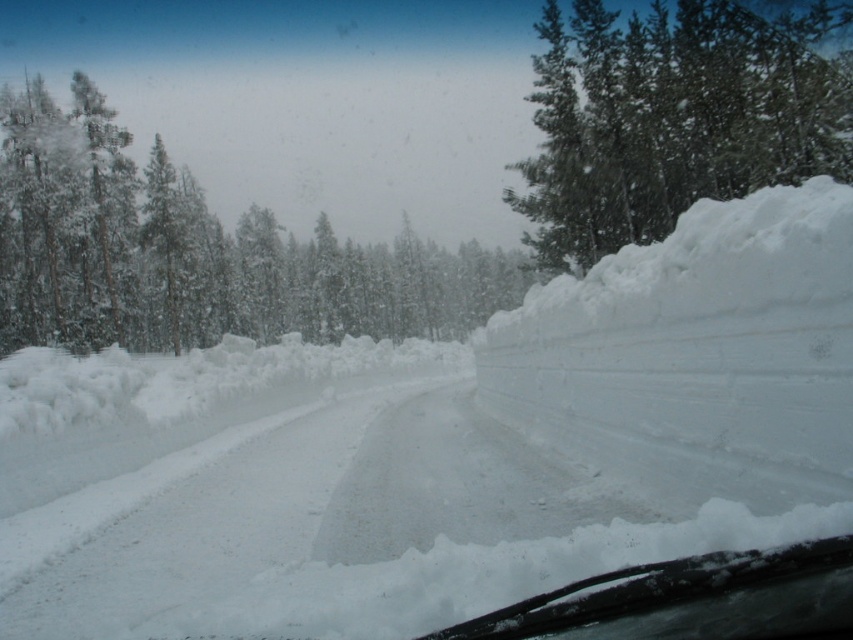
You are a driver planning to take a scenic route through this snowy area. You notice the white frosty trees at upper center and the green textured snow at upper right in your view. Which of these two elements takes up more visual space in the scene?

The green textured snow at upper right takes up more visual space than the white frosty trees at upper center.

You are driving a car and looking through the windshield. You notice the green textured snow at upper right and the clear glass windshield at lower center. Which object appears wider from your viewpoint?

The green textured snow at upper right appears wider than the clear glass windshield at lower center because its width surpasses the windshield.

You are driving a car and looking through the windshield. You see white fluffy snow at center and green textured snow at upper right. Which one is closer to your car?

The white fluffy snow at center is closer to your car because it is positioned to the left of green textured snow at upper right, indicating it is in front of the car while the green textured snow at upper right is further away.